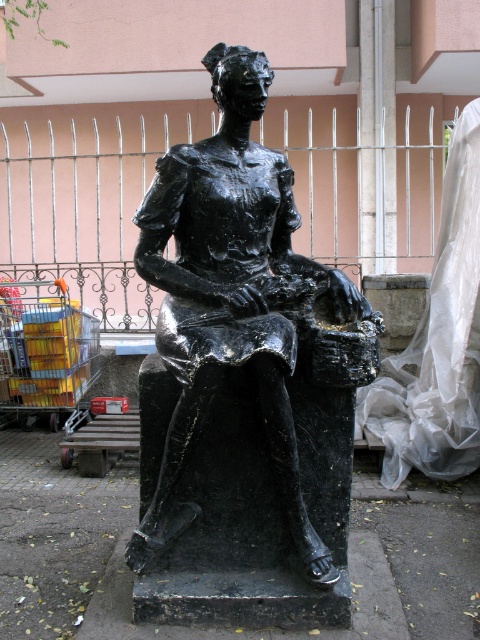
Question: Can you confirm if black polished statue at center is wider than metallic yellow cart at lower left?

Choices:
 (A) yes
 (B) no

Answer: (A)

Question: Which point is closer to the camera?

Choices:
 (A) (32, 408)
 (B) (157, 241)

Answer: (B)

Question: Can you confirm if black polished statue at center is bigger than metallic yellow cart at lower left?

Choices:
 (A) yes
 (B) no

Answer: (A)

Question: Is black polished statue at center to the left of metallic yellow cart at lower left from the viewer's perspective?

Choices:
 (A) no
 (B) yes

Answer: (A)